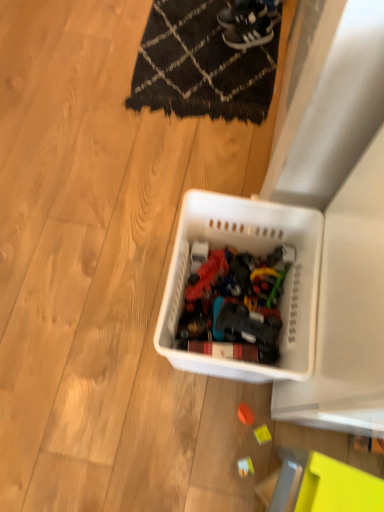
Question: From the image's perspective, does black woven mat at upper center appear higher than white plastic toy at lower center, the third toy in the top-to-bottom sequence?

Choices:
 (A) no
 (B) yes

Answer: (B)

Question: Can you confirm if black woven mat at upper center is wider than white plastic toy at lower center, the third toy in the top-to-bottom sequence?

Choices:
 (A) no
 (B) yes

Answer: (B)

Question: Is black woven mat at upper center completely or partially outside of white plastic toy at lower center, the third toy in the top-to-bottom sequence?

Choices:
 (A) no
 (B) yes

Answer: (B)

Question: Considering the relative sizes of black woven mat at upper center and white plastic toy at lower center, which ranks as the 1th toy in bottom-to-top order, in the image provided, is black woven mat at upper center bigger than white plastic toy at lower center, which ranks as the 1th toy in bottom-to-top order,?

Choices:
 (A) yes
 (B) no

Answer: (A)

Question: Does black woven mat at upper center contain white plastic toy at lower center, the third toy in the top-to-bottom sequence?

Choices:
 (A) yes
 (B) no

Answer: (B)

Question: Considering the positions of point 226,230 and point 213,103, is point 226,230 closer or farther from the camera than point 213,103?

Choices:
 (A) closer
 (B) farther

Answer: (A)

Question: From a real-world perspective, relative to black woven mat at upper center, is white plastic basket at center vertically above or below?

Choices:
 (A) above
 (B) below

Answer: (A)

Question: Looking at their shapes, would you say white plastic basket at center is wider or thinner than black woven mat at upper center?

Choices:
 (A) wide
 (B) thin

Answer: (B)

Question: From their relative heights in the image, would you say white plastic basket at center is taller or shorter than black woven mat at upper center?

Choices:
 (A) tall
 (B) short

Answer: (A)

Question: Relative to black woven mat at upper center, is orange matte ball at center, acting as the 3th toy starting from the bottom, in front or behind?

Choices:
 (A) behind
 (B) front

Answer: (B)

Question: Is orange matte ball at center, acting as the 3th toy starting from the bottom, inside the boundaries of black woven mat at upper center, or outside?

Choices:
 (A) outside
 (B) inside

Answer: (A)

Question: Considering the positions of orange matte ball at center, which ranks as the 1th toy in top-to-bottom order, and black woven mat at upper center in the image, is orange matte ball at center, which ranks as the 1th toy in top-to-bottom order, bigger or smaller than black woven mat at upper center?

Choices:
 (A) big
 (B) small

Answer: (B)

Question: Considering the positions of orange matte ball at center, acting as the 3th toy starting from the bottom, and black woven mat at upper center in the image, is orange matte ball at center, acting as the 3th toy starting from the bottom, taller or shorter than black woven mat at upper center?

Choices:
 (A) short
 (B) tall

Answer: (A)

Question: Is point (188, 272) closer or farther from the camera than point (228, 34)?

Choices:
 (A) closer
 (B) farther

Answer: (A)

Question: From their relative heights in the image, would you say white plastic basket at center is taller or shorter than white leather sneakers at upper center, the first footwear from the bottom?

Choices:
 (A) short
 (B) tall

Answer: (B)